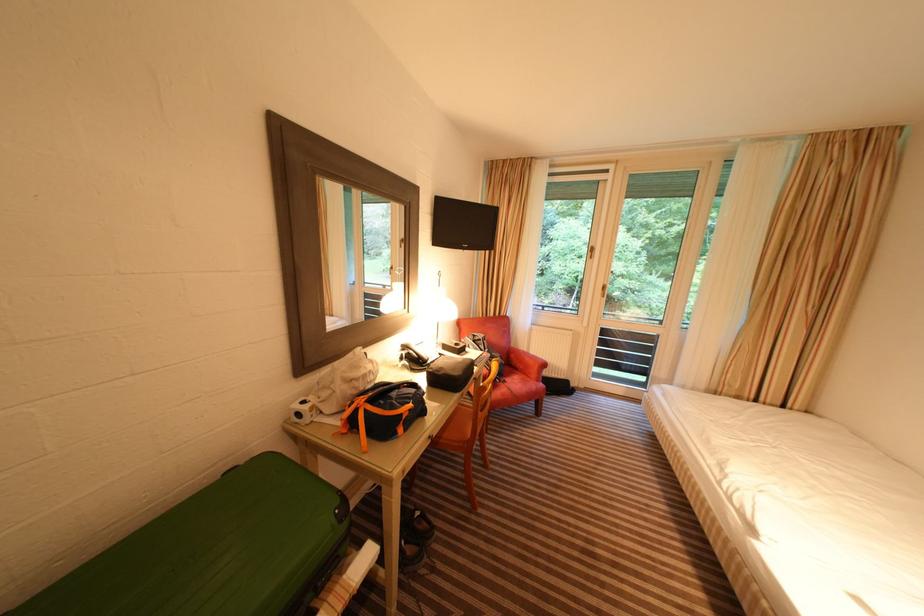
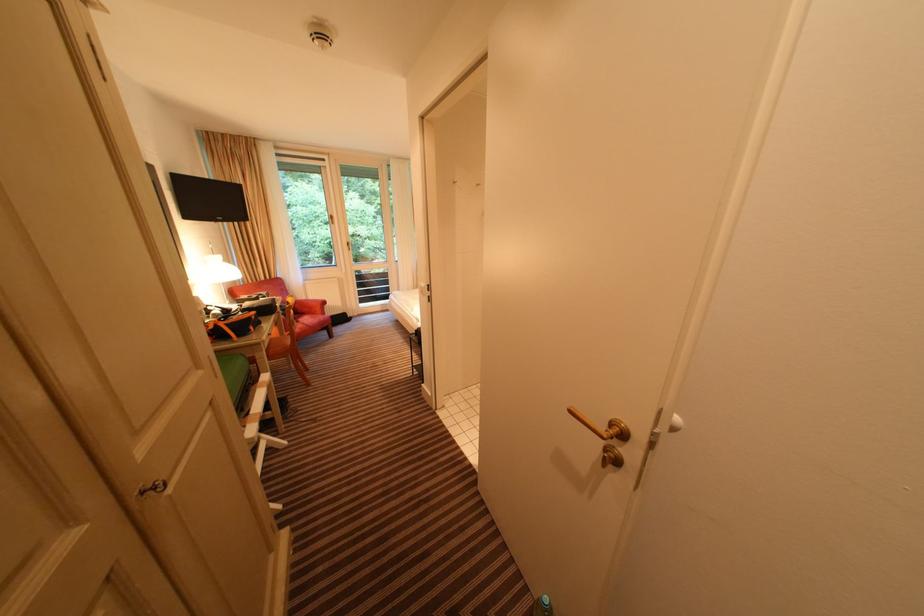
Find the pixel in the second image that matches (540,354) in the first image.

(319, 300)